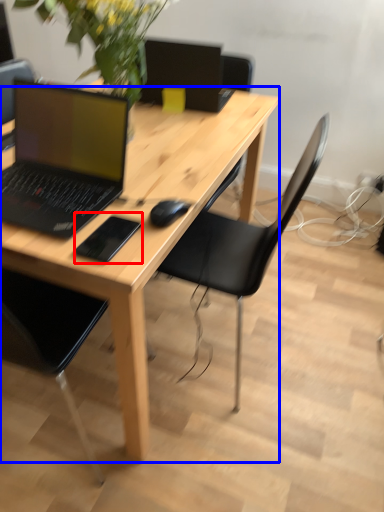
Question: Among these objects, which one is farthest to the camera, mousepad (highlighted by a red box) or desk (highlighted by a blue box)?

Choices:
 (A) mousepad
 (B) desk

Answer: (A)